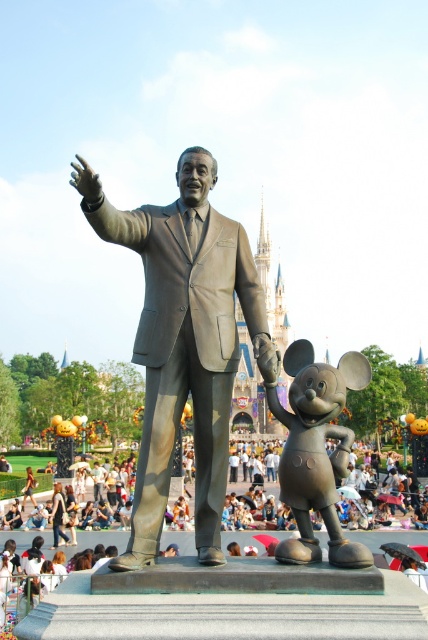
Question: Which object is the closest to the matte bronze statue at center?

Choices:
 (A) bronze statue at center
 (B) bronze mickey mouse at center

Answer: (B)

Question: Can you confirm if bronze statue at center is wider than matte bronze statue at center?

Choices:
 (A) no
 (B) yes

Answer: (A)

Question: From the image, what is the correct spatial relationship of bronze statue at center in relation to bronze mickey mouse at center?

Choices:
 (A) left
 (B) right

Answer: (A)

Question: Estimate the real-world distances between objects in this image. Which object is farther from the matte bronze statue at center?

Choices:
 (A) bronze mickey mouse at center
 (B) bronze statue at center

Answer: (B)

Question: Does matte bronze statue at center appear on the left side of bronze mickey mouse at center?

Choices:
 (A) no
 (B) yes

Answer: (B)

Question: Among these objects, which one is nearest to the camera?

Choices:
 (A) matte bronze statue at center
 (B) bronze mickey mouse at center

Answer: (A)